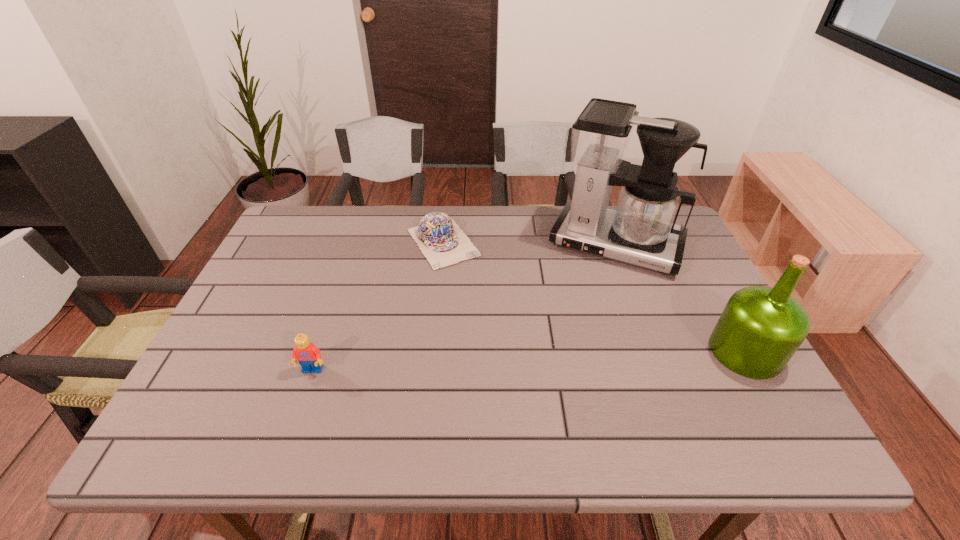
At what (x,y) coordinates should I click in order to perform the action: click on vacant space on the desktop that is between the Lego and the olive oil and is positioned at the front of the coffee maker where the controls are located. Please return your answer as a coordinate pair (x, y). Looking at the image, I should click on (573, 359).

Where is `vacant space on the desktop that is between the Lego and the olive oil and is positioned on the front, side, and top of the shortest object`? The width and height of the screenshot is (960, 540). vacant space on the desktop that is between the Lego and the olive oil and is positioned on the front, side, and top of the shortest object is located at coordinates (529, 361).